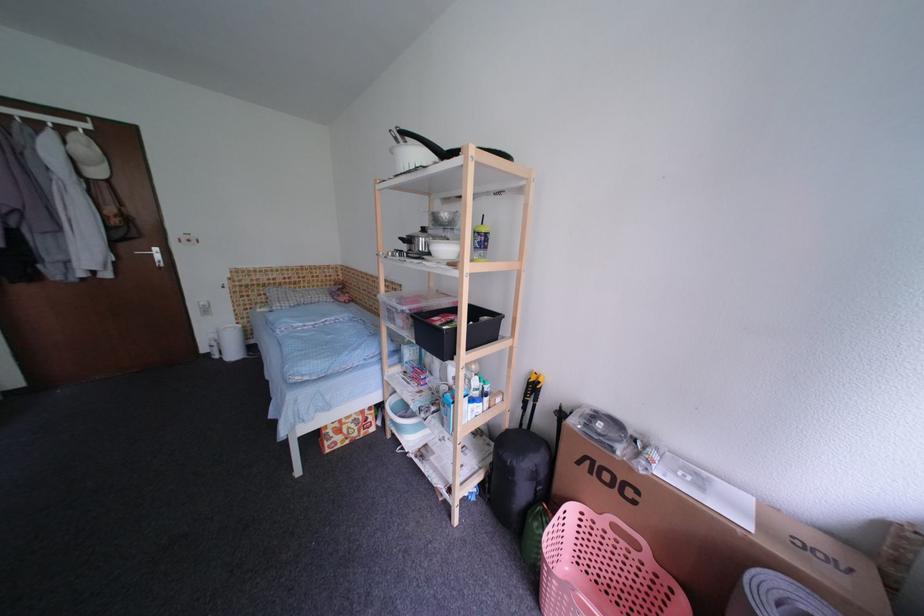
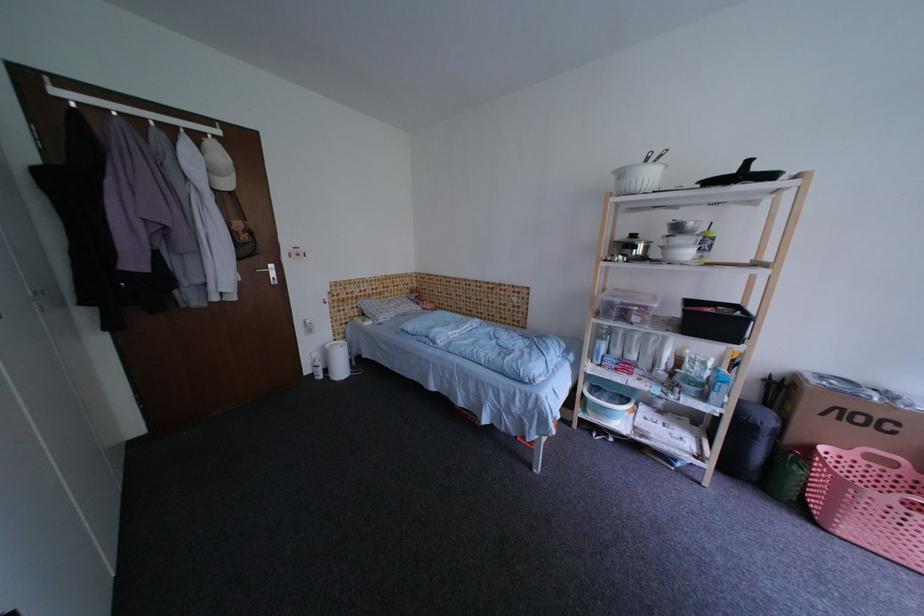
The point at [92,148] is marked in the first image. Where is the corresponding point in the second image?

(227, 158)